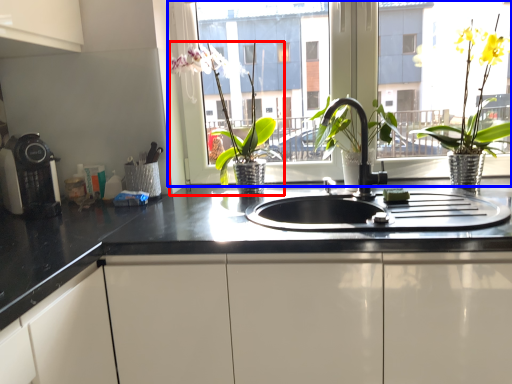
Question: Among these objects, which one is nearest to the camera, houseplant (highlighted by a red box) or window (highlighted by a blue box)?

Choices:
 (A) houseplant
 (B) window

Answer: (A)